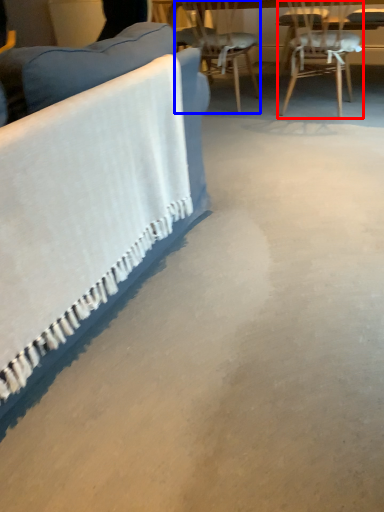
Question: Which of the following is the farthest to the observer, chair (highlighted by a red box) or chair (highlighted by a blue box)?

Choices:
 (A) chair
 (B) chair

Answer: (B)